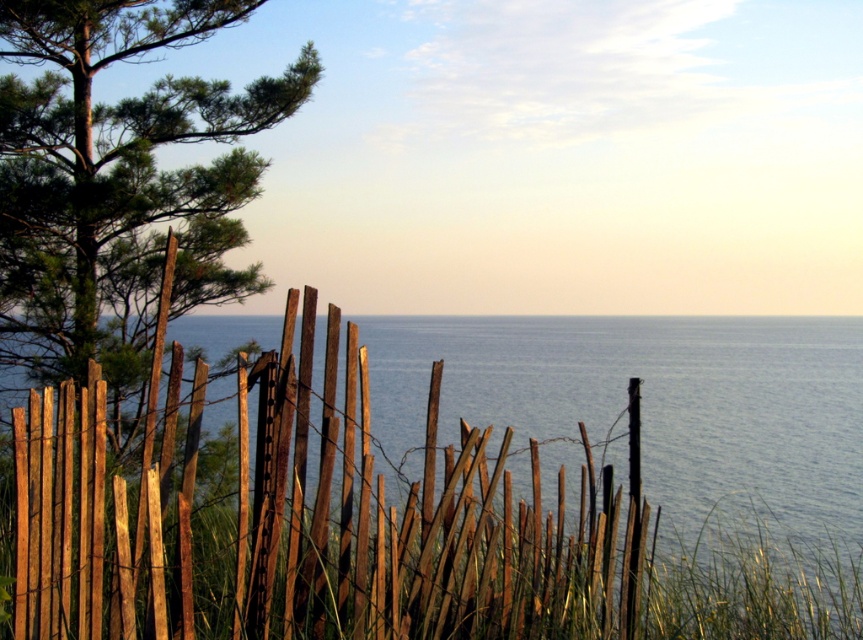
You are a painter setting up your easel to capture the scene of the weathered wood fence at center and the green matte tree at upper left. You want to ensure the fence is visible in the foreground without being blocked by the tree. Based on the scene, is the fence placed in a position where it won

The weathered wood fence at center is positioned under the green matte tree at upper left, so the tree is above the fence. This means the fence will be visible in the foreground as it is below the tree, so the tree won

You are a painter setting up your easel to capture the coastal scene. You want to ensure both the weathered wood fence at center and the green matte tree at upper left are clearly visible in your painting. Given their sizes, which object should you position closer to the foreground to maintain their visibility?

The weathered wood fence at center is larger in size than the green matte tree at upper left, so to maintain visibility of both, you should position the green matte tree at upper left closer to the foreground since it is smaller and might get lost if placed further back.